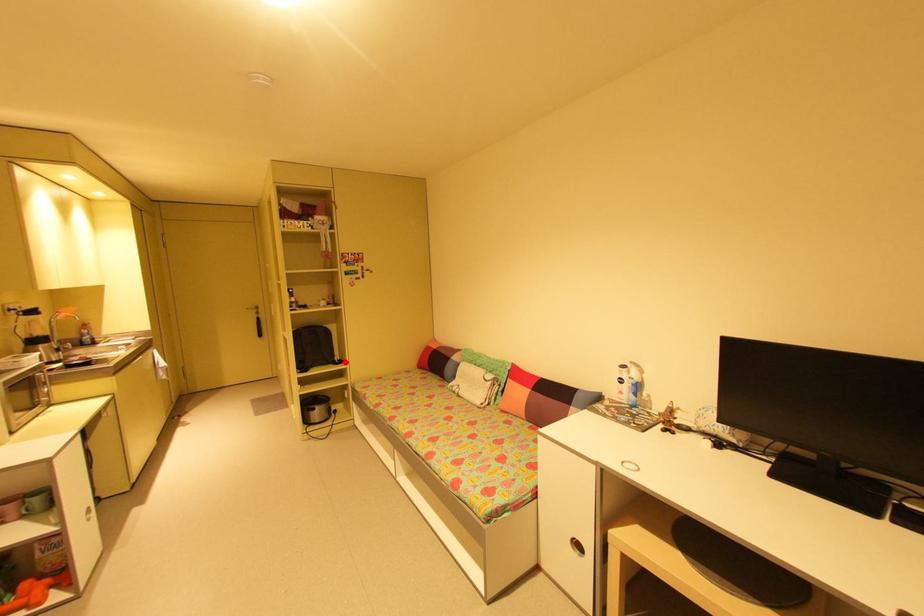
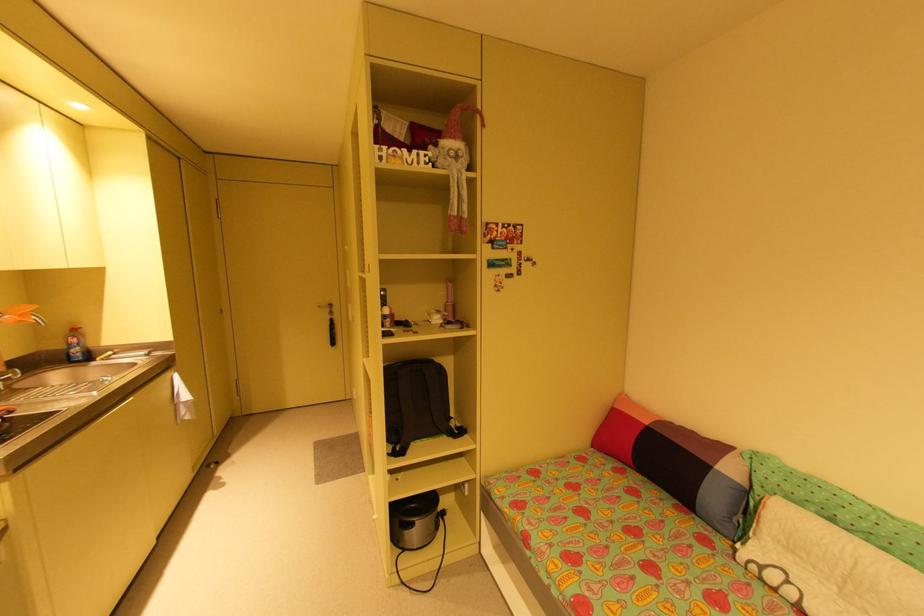
Locate, in the second image, the point that corresponds to the highlighted location in the first image.

(466, 431)